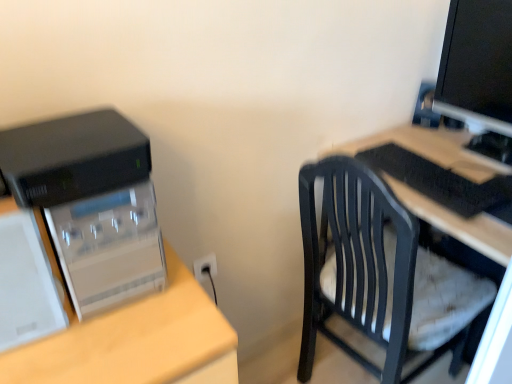
Question: Is black glossy monitor at upper right positioned far away from black plastic keyboard at right?

Choices:
 (A) yes
 (B) no

Answer: (B)

Question: Does black glossy monitor at upper right have a smaller size compared to black plastic keyboard at right?

Choices:
 (A) yes
 (B) no

Answer: (B)

Question: Is black glossy monitor at upper right bigger than black plastic keyboard at right?

Choices:
 (A) yes
 (B) no

Answer: (A)

Question: Can you confirm if black glossy monitor at upper right is taller than black plastic keyboard at right?

Choices:
 (A) no
 (B) yes

Answer: (B)

Question: Can you confirm if black glossy monitor at upper right is thinner than black plastic keyboard at right?

Choices:
 (A) no
 (B) yes

Answer: (B)

Question: Considering the relative positions of black glossy monitor at upper right and black plastic keyboard at right in the image provided, is black glossy monitor at upper right to the left of black plastic keyboard at right from the viewer's perspective?

Choices:
 (A) yes
 (B) no

Answer: (B)

Question: Is black plastic chair at right completely or partially inside black glossy monitor at upper right?

Choices:
 (A) no
 (B) yes

Answer: (A)

Question: Is black glossy monitor at upper right oriented away from black plastic chair at right?

Choices:
 (A) no
 (B) yes

Answer: (A)

Question: Can you confirm if black glossy monitor at upper right is positioned to the left of black plastic chair at right?

Choices:
 (A) no
 (B) yes

Answer: (A)

Question: Is black glossy monitor at upper right located outside black plastic chair at right?

Choices:
 (A) no
 (B) yes

Answer: (B)

Question: Does black glossy monitor at upper right come behind black plastic chair at right?

Choices:
 (A) no
 (B) yes

Answer: (B)

Question: Are black glossy monitor at upper right and black plastic chair at right beside each other?

Choices:
 (A) no
 (B) yes

Answer: (A)

Question: Is black plastic chair at right far away from black plastic computer tower at left?

Choices:
 (A) no
 (B) yes

Answer: (A)